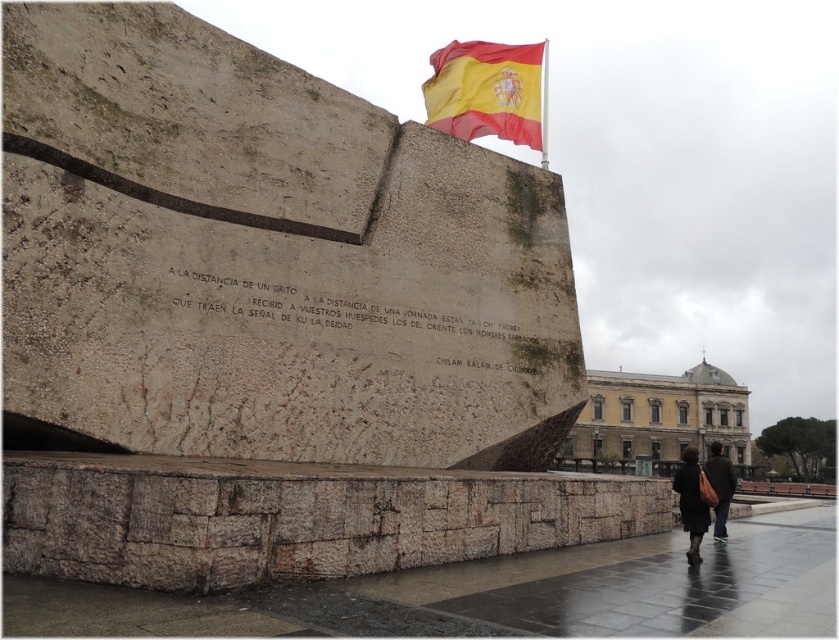
You are standing at the center of the monument and want to place a new plaque at the same height as the dark brown leather coat at lower right. Where should you place the plaque?

The dark brown leather coat at lower right is located at coordinates point (691, 502), so you should place the plaque at the same coordinates to match its height.

From the picture: You are a visitor at the monument and see both the dark brown leather coat at lower right and the dark brown leather jacket at lower right. Which one is smaller in size?

The dark brown leather coat at lower right is smaller than the dark brown leather jacket at lower right.